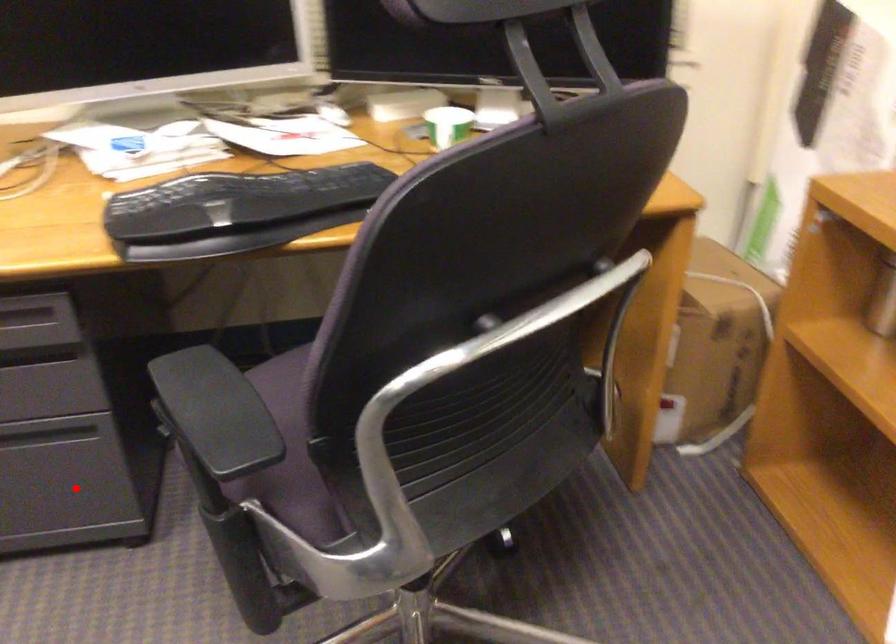
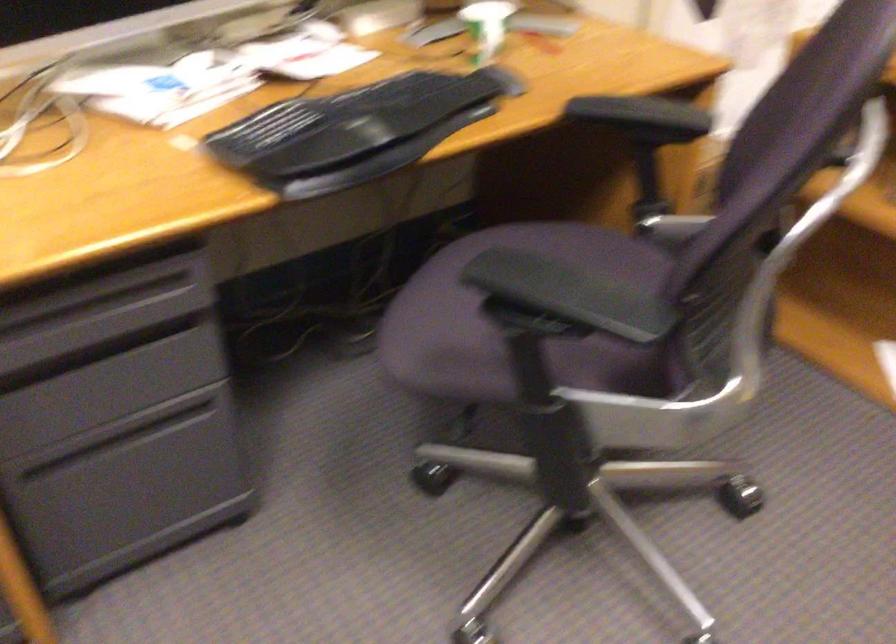
Question: I am providing you with two images of the same scene from different viewpoints. A red point is marked on the first image. Is the red point's position out of view in image 2?

Choices:
 (A) Yes
 (B) No

Answer: (B)